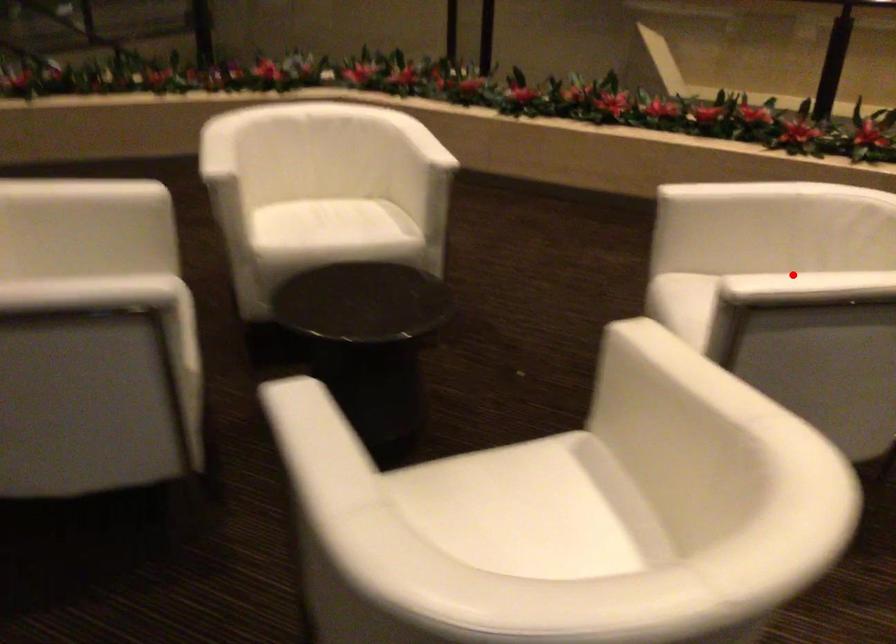
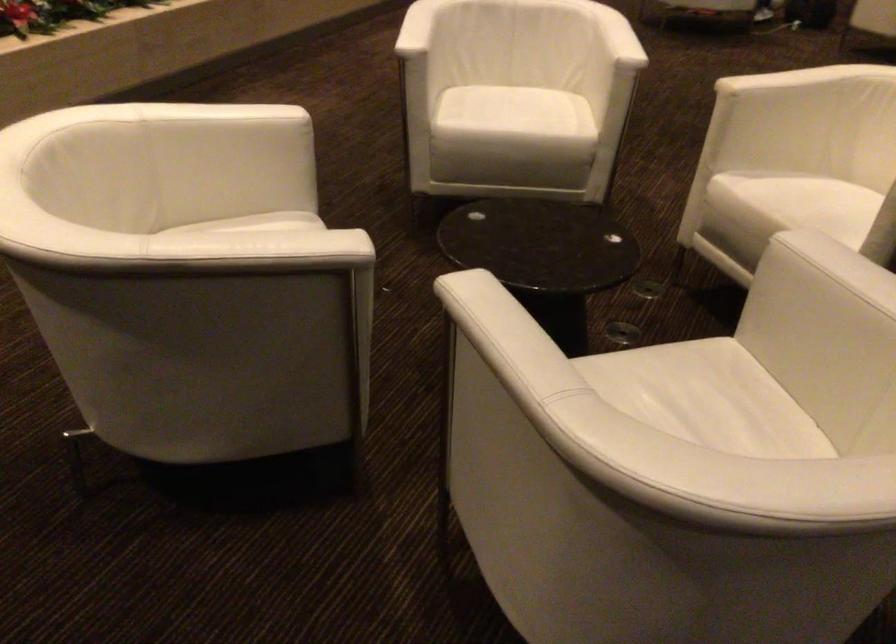
Question: I am providing you with two images of the same scene from different viewpoints. In image1, a red point is highlighted. Considering the same 3D point in image2, which of the following is correct?

Choices:
 (A) It is closer
 (B) It is farther

Answer: (B)